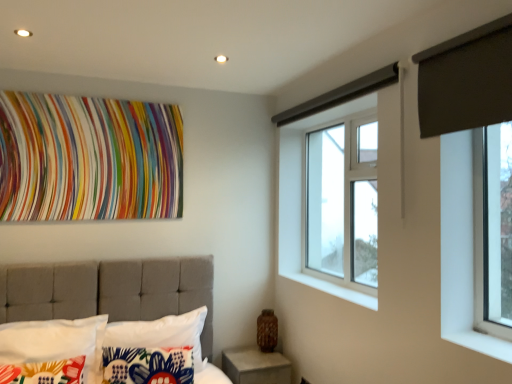
Question: Can you confirm if white fabric pillow at lower left, arranged as the 3th pillow when viewed from the left, is bigger than dark gray fabric at upper right?

Choices:
 (A) no
 (B) yes

Answer: (B)

Question: Does white fabric pillow at lower left, arranged as the 3th pillow when viewed from the left, turn towards dark gray fabric at upper right?

Choices:
 (A) yes
 (B) no

Answer: (B)

Question: Is white fabric pillow at lower left, the first pillow from the right, taller than dark gray fabric at upper right?

Choices:
 (A) yes
 (B) no

Answer: (A)

Question: Is white fabric pillow at lower left, the first pillow from the right, at the left side of dark gray fabric at upper right?

Choices:
 (A) yes
 (B) no

Answer: (A)

Question: Is there a large distance between white fabric pillow at lower left, arranged as the 3th pillow when viewed from the left, and dark gray fabric at upper right?

Choices:
 (A) yes
 (B) no

Answer: (A)

Question: Looking at their shapes, would you say white fabric pillow at lower left, arranged as the 3th pillow when viewed from the left, is wider or thinner than dark gray fabric at upper right?

Choices:
 (A) wide
 (B) thin

Answer: (A)

Question: From the image's perspective, is white fabric pillow at lower left, the first pillow from the right, located above or below dark gray fabric at upper right?

Choices:
 (A) above
 (B) below

Answer: (B)

Question: Relative to dark gray fabric at upper right, is white fabric pillow at lower left, arranged as the 3th pillow when viewed from the left, in front or behind?

Choices:
 (A) front
 (B) behind

Answer: (B)

Question: Considering the positions of white fabric pillow at lower left, arranged as the 3th pillow when viewed from the left, and dark gray fabric at upper right in the image, is white fabric pillow at lower left, arranged as the 3th pillow when viewed from the left, bigger or smaller than dark gray fabric at upper right?

Choices:
 (A) big
 (B) small

Answer: (A)

Question: From a real-world perspective, is white concrete at lower center physically located above or below clear glass window at upper center?

Choices:
 (A) above
 (B) below

Answer: (B)

Question: In the image, is white concrete at lower center positioned in front of or behind clear glass window at upper center?

Choices:
 (A) front
 (B) behind

Answer: (A)

Question: From the image's perspective, is white concrete at lower center located above or below clear glass window at upper center?

Choices:
 (A) below
 (B) above

Answer: (A)

Question: Based on their positions, is white concrete at lower center located to the left or right of clear glass window at upper center?

Choices:
 (A) right
 (B) left

Answer: (B)

Question: Is floral fabric pillow at lower left, the 2th pillow in the right-to-left sequence, inside the boundaries of clear glass window at upper center, or outside?

Choices:
 (A) outside
 (B) inside

Answer: (A)

Question: Is floral fabric pillow at lower left, the 2th pillow in the right-to-left sequence, bigger or smaller than clear glass window at upper center?

Choices:
 (A) small
 (B) big

Answer: (A)